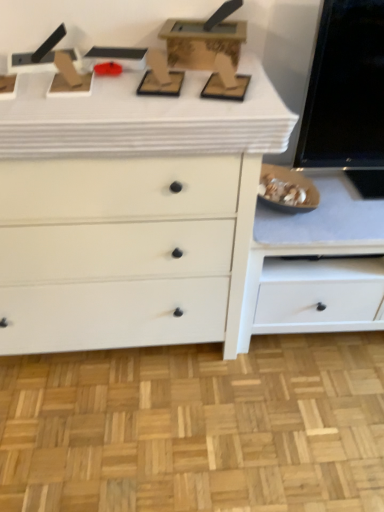
This screenshot has height=512, width=384. What do you see at coordinates (144, 119) in the screenshot?
I see `white matte counter top at upper center` at bounding box center [144, 119].

The width and height of the screenshot is (384, 512). Describe the element at coordinates (130, 212) in the screenshot. I see `white matte chest of drawers at center` at that location.

I want to click on white matte counter top at upper center, so click(x=144, y=119).

Would you consider white matte cabinet at lower right to be distant from white matte chest of drawers at center?

No, white matte cabinet at lower right is not far away from white matte chest of drawers at center.

Considering the sizes of objects white matte cabinet at lower right and white matte chest of drawers at center in the image provided, who is smaller, white matte cabinet at lower right or white matte chest of drawers at center?

With smaller size is white matte cabinet at lower right.

Is white matte cabinet at lower right taller than white matte chest of drawers at center?

No.

Between white matte cabinet at lower right and white matte chest of drawers at center, which one has larger width?

white matte chest of drawers at center.

From a real-world perspective, who is located higher, white matte counter top at upper center or white matte cabinet at lower right?

From a 3D spatial view, white matte counter top at upper center is above.

Which of these two, white matte counter top at upper center or white matte cabinet at lower right, is thinner?

white matte cabinet at lower right is thinner.

Is the surface of white matte counter top at upper center in direct contact with white matte cabinet at lower right?

white matte counter top at upper center and white matte cabinet at lower right are not in contact.

Where is `the chest of drawers below the white matte counter top at upper center (from the image's perspective)`? the chest of drawers below the white matte counter top at upper center (from the image's perspective) is located at coordinates (130, 212).

How different are the orientations of white matte counter top at upper center and white matte chest of drawers at center in degrees?

There is a 0.886-degree angle between the facing directions of white matte counter top at upper center and white matte chest of drawers at center.

Based on their sizes in the image, would you say white matte counter top at upper center is bigger or smaller than white matte chest of drawers at center?

Clearly, white matte counter top at upper center is smaller in size than white matte chest of drawers at center.

Between point (18, 103) and point (53, 311), which one is positioned in front?

Positioned in front is point (18, 103).

Is white matte chest of drawers at center completely or partially outside of white matte cabinet at lower right?

That's correct, white matte chest of drawers at center is outside of white matte cabinet at lower right.

Is white matte chest of drawers at center oriented towards white matte cabinet at lower right?

No.

Between white matte chest of drawers at center and white matte cabinet at lower right, which one has more height?

Standing taller between the two is white matte chest of drawers at center.

Is white matte chest of drawers at center positioned far away from white matte cabinet at lower right?

That's not correct — white matte chest of drawers at center is a little close to white matte cabinet at lower right.

From the image's perspective, does white matte chest of drawers at center appear lower than white matte counter top at upper center?

Yes.

From the picture: Between white matte chest of drawers at center and white matte counter top at upper center, which one has smaller size?

Smaller between the two is white matte counter top at upper center.

Considering the sizes of white matte chest of drawers at center and white matte counter top at upper center in the image, is white matte chest of drawers at center wider or thinner than white matte counter top at upper center?

white matte chest of drawers at center is thinner than white matte counter top at upper center.

In terms of width, does white matte cabinet at lower right look wider or thinner when compared to white matte counter top at upper center?

Clearly, white matte cabinet at lower right has less width compared to white matte counter top at upper center.

Between white matte cabinet at lower right and white matte counter top at upper center, which one has more height?

white matte cabinet at lower right.

Is white matte cabinet at lower right looking in the opposite direction of white matte counter top at upper center?

white matte cabinet at lower right is not turned away from white matte counter top at upper center.

Considering the positions of point (373, 272) and point (14, 100), is point (373, 272) closer or farther from the camera than point (14, 100)?

Point (373, 272).

You are a GUI agent. You are given a task and a screenshot of the screen. Output one action in this format:
    pyautogui.click(x=<x>, y=<y>)
    Task: Click on the chest of drawers to the left of white matte cabinet at lower right
    The height and width of the screenshot is (512, 384).
    Given the screenshot: What is the action you would take?
    pyautogui.click(x=130, y=212)

What are the coordinates of `cabinetry lying behind the white matte counter top at upper center` in the screenshot? It's located at (316, 266).

When comparing their distances from white matte chest of drawers at center, does white matte counter top at upper center or white matte cabinet at lower right seem further?

The object further to white matte chest of drawers at center is white matte cabinet at lower right.

When comparing their distances from white matte counter top at upper center, does white matte cabinet at lower right or white matte chest of drawers at center seem closer?

white matte chest of drawers at center.

Estimate the real-world distances between objects in this image. Which object is further from white matte cabinet at lower right, white matte counter top at upper center or white matte chest of drawers at center?

white matte counter top at upper center.

From the image, which object appears to be nearer to white matte counter top at upper center, white matte chest of drawers at center or white matte cabinet at lower right?

The object closer to white matte counter top at upper center is white matte chest of drawers at center.

From the image, which object appears to be farther from white matte cabinet at lower right, white matte chest of drawers at center or white matte counter top at upper center?

The object further to white matte cabinet at lower right is white matte counter top at upper center.

Considering their positions, is white matte cabinet at lower right positioned further to white matte chest of drawers at center than white matte counter top at upper center?

white matte cabinet at lower right is further to white matte chest of drawers at center.

Locate an element on the screen. The width and height of the screenshot is (384, 512). counter top between white matte chest of drawers at center and white matte cabinet at lower right from left to right is located at coordinates (144, 119).